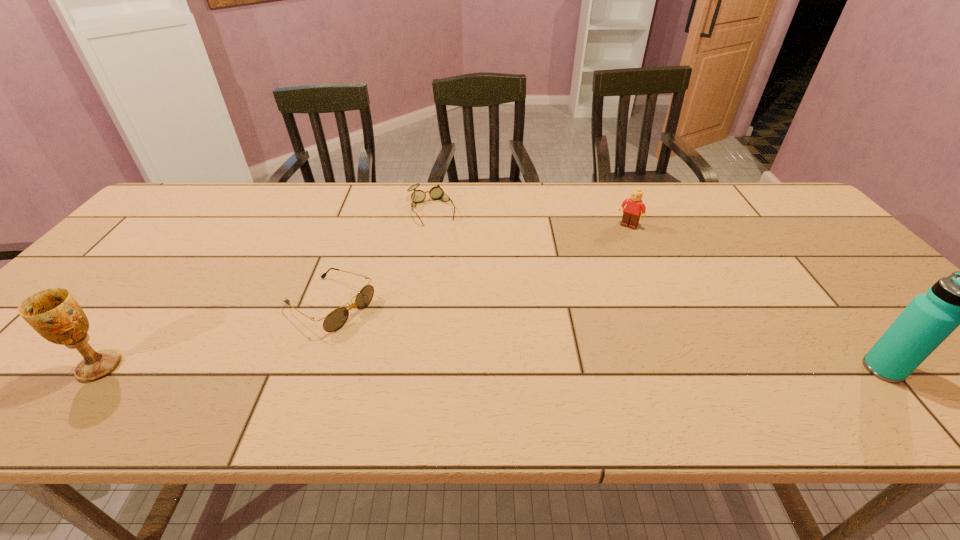
Image resolution: width=960 pixels, height=540 pixels. In order to click on vacant space at the right edge of the desktop in this screenshot , I will do `click(811, 273)`.

The width and height of the screenshot is (960, 540). Identify the location of vacant space at the near left corner of the desktop. (54, 346).

Where is `vacant area that lies between the water bottle and the Lego`? The width and height of the screenshot is (960, 540). vacant area that lies between the water bottle and the Lego is located at coordinates (756, 298).

Where is `free space between the sunglasses and the Lego`? Image resolution: width=960 pixels, height=540 pixels. free space between the sunglasses and the Lego is located at coordinates (479, 266).

Identify the location of vacant space that's between the water bottle and the Lego. (756, 298).

You are a GUI agent. You are given a task and a screenshot of the screen. Output one action in this format:
    pyautogui.click(x=<x>, y=<y>)
    Task: Click on the vacant region between the chalice and the fourth object from right to left
    The image size is (960, 540).
    Given the screenshot: What is the action you would take?
    pyautogui.click(x=215, y=336)

Locate an element on the screen. This screenshot has width=960, height=540. free space between the spectacles and the rightmost object is located at coordinates (657, 289).

Locate an element on the screen. The image size is (960, 540). unoccupied area between the third farthest object and the second tallest object is located at coordinates click(x=215, y=336).

The image size is (960, 540). Find the location of `free space that is in between the fourth shortest object and the water bottle`. free space that is in between the fourth shortest object and the water bottle is located at coordinates (492, 368).

Image resolution: width=960 pixels, height=540 pixels. I want to click on unoccupied area between the sunglasses and the spectacles, so click(x=380, y=258).